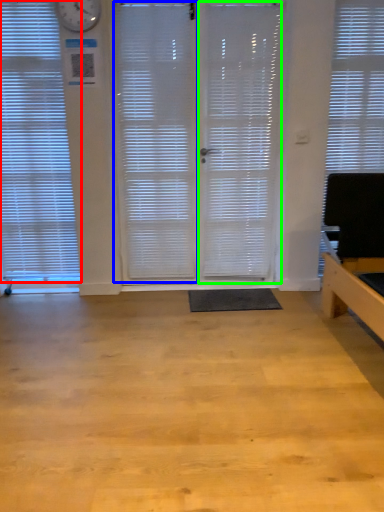
Question: Considering the real-world distances, which object is farthest from window blind (highlighted by a red box)? shutter (highlighted by a blue box) or screen door (highlighted by a green box)?

Choices:
 (A) shutter
 (B) screen door

Answer: (B)